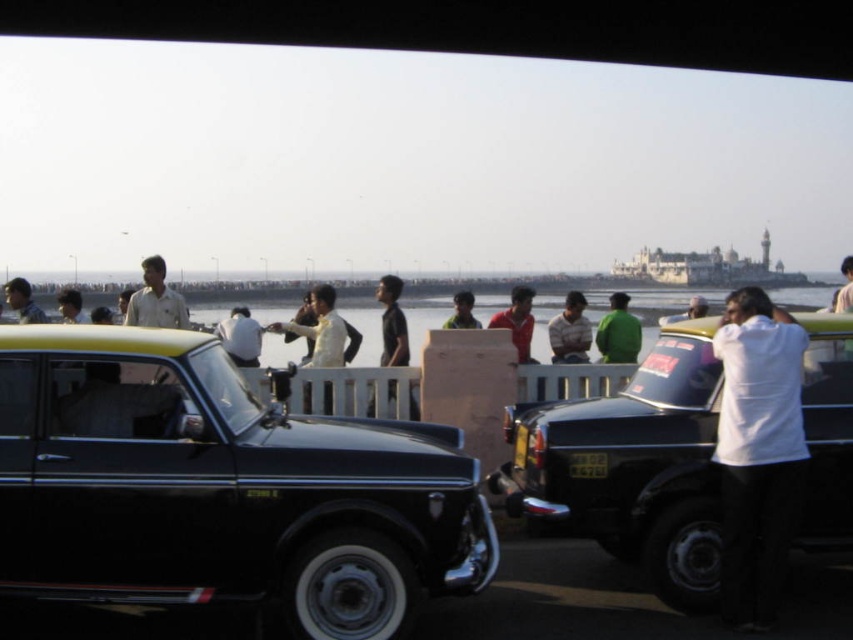
Based on the photo, you are a photographer trying to capture a group of people at the waterfront. You notice two individuals wearing a green matte shirt at center and a matte red shirt at center. Which person should you focus on to ensure you capture the most detailed image, considering their size in the frame?

The matte red shirt at center occupies more space than the green matte shirt at center, so focusing on the person wearing the matte red shirt at center will result in a more detailed image due to their larger presence in the frame.

You are standing at the waterfront and see two people in the midground wearing a green matte shirt at center and a light brown leather jacket at center. Which one is positioned more to the left?

The light brown leather jacket at center is positioned more to the left because the green matte shirt at center is to the right of it.